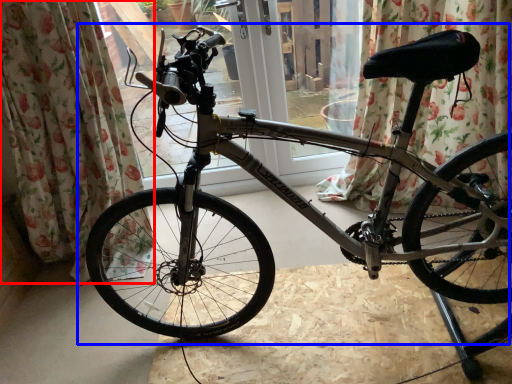
Question: Which of the following is the farthest to the observer, curtain (highlighted by a red box) or bicycle (highlighted by a blue box)?

Choices:
 (A) curtain
 (B) bicycle

Answer: (A)